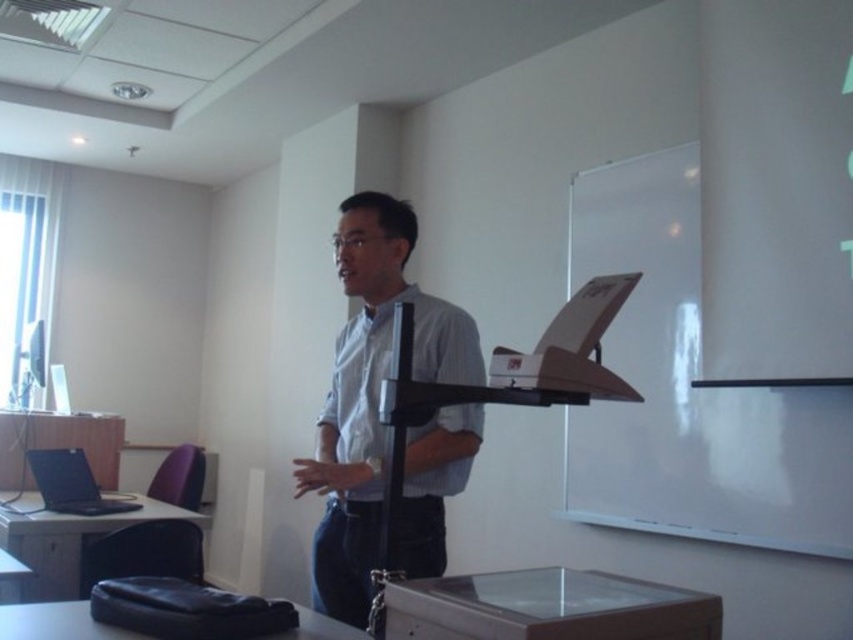
Who is shorter, white matte board at upper right or light blue shirt at center?

With less height is light blue shirt at center.

Find the location of a particular element. This screenshot has height=640, width=853. white matte board at upper right is located at coordinates (691, 388).

Is point (621, 433) farther from camera compared to point (398, 284)?

Yes, point (621, 433) is farther from viewer.

Image resolution: width=853 pixels, height=640 pixels. In order to click on white matte board at upper right in this screenshot , I will do `click(691, 388)`.